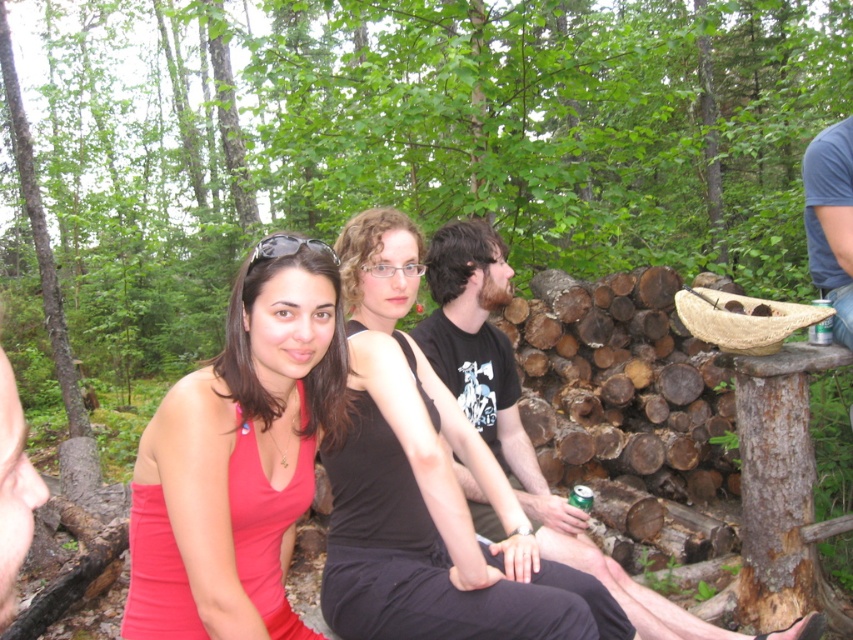
Question: Which point is closer to the camera taking this photo?

Choices:
 (A) (468, 237)
 (B) (447, 600)

Answer: (B)

Question: Which object appears farthest from the camera in this image?

Choices:
 (A) black t-shirt at center
 (B) black matte tank top at center
 (C) matte red tank top at center

Answer: (A)

Question: Is matte red tank top at center wider than black t-shirt at center?

Choices:
 (A) yes
 (B) no

Answer: (B)

Question: Which point is closer to the camera?

Choices:
 (A) black matte tank top at center
 (B) matte red tank top at center
 (C) black t-shirt at center

Answer: (B)

Question: Can you confirm if matte red tank top at center is positioned to the right of black t-shirt at center?

Choices:
 (A) yes
 (B) no

Answer: (B)

Question: Can you confirm if matte red tank top at center is bigger than black matte tank top at center?

Choices:
 (A) no
 (B) yes

Answer: (A)